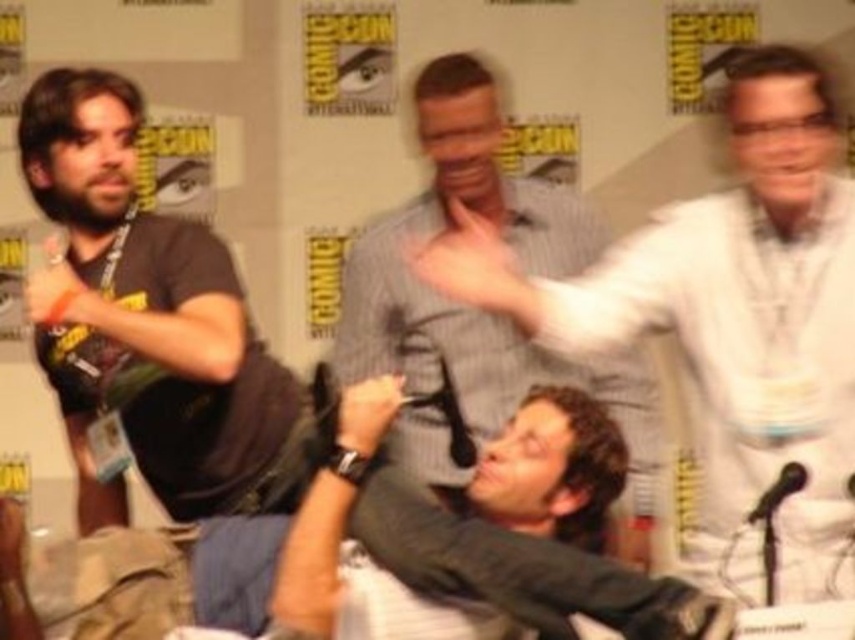
Measure the distance between matte black t-shirt at left and camera.

matte black t-shirt at left is 8.19 feet from camera.

Based on the photo, measure the distance from matte black t-shirt at left to gray striped shirt at center.

They are 33.80 inches apart.

Locate an element on the screen. The image size is (855, 640). matte black t-shirt at left is located at coordinates (142, 316).

Does white shirt at upper right have a smaller size compared to matte black t-shirt at left?

Correct, white shirt at upper right occupies less space than matte black t-shirt at left.

The image size is (855, 640). Describe the element at coordinates (729, 323) in the screenshot. I see `white shirt at upper right` at that location.

Does point (450, 243) come behind point (166, 490)?

Yes, point (450, 243) is behind point (166, 490).

Locate an element on the screen. Image resolution: width=855 pixels, height=640 pixels. white shirt at upper right is located at coordinates (729, 323).

How much distance is there between white shirt at upper right and gray striped shirt at center?

white shirt at upper right is 31.63 inches from gray striped shirt at center.

Between white shirt at upper right and gray striped shirt at center, which one appears on the left side from the viewer's perspective?

gray striped shirt at center is more to the left.

Find the location of a particular element. The image size is (855, 640). white shirt at upper right is located at coordinates (729, 323).